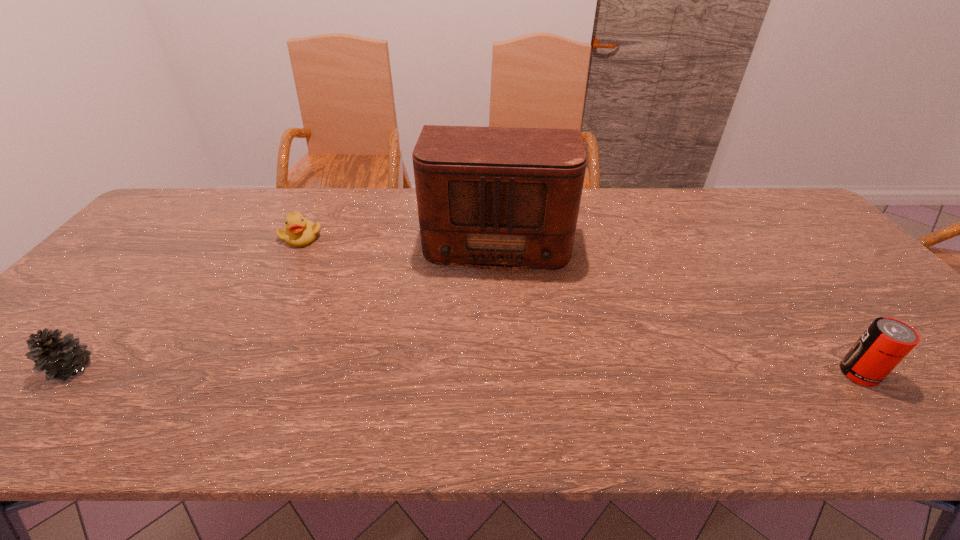
Identify the location of vacant space that's between the tallest object and the leftmost object. coord(284,303).

Where is `vacant point located between the radio receiver and the leftmost object`? This screenshot has height=540, width=960. vacant point located between the radio receiver and the leftmost object is located at coordinates (284, 303).

I want to click on empty location between the shortest object and the third shortest object, so click(x=580, y=305).

The height and width of the screenshot is (540, 960). What are the coordinates of `free area in between the leftmost object and the radio receiver` in the screenshot? It's located at (284, 303).

Image resolution: width=960 pixels, height=540 pixels. I want to click on empty space that is in between the rightmost object and the third object from right to left, so click(x=580, y=305).

At what (x,y) coordinates should I click in order to perform the action: click on the closest object to the tallest object. Please return your answer as a coordinate pair (x, y). The height and width of the screenshot is (540, 960). Looking at the image, I should click on tap(299, 232).

Select which object is the third closest to the rightmost object. Please provide its 2D coordinates. Your answer should be formatted as a tuple, i.e. [(x, y)], where the tuple contains the x and y coordinates of a point satisfying the conditions above.

[(60, 358)]

This screenshot has height=540, width=960. What are the coordinates of `vacant region that satisfies the following two spatial constraints: 1. on the front side of the shortest object; 2. on the left side of the tallest object` in the screenshot? It's located at (300, 238).

This screenshot has height=540, width=960. I want to click on vacant point that satisfies the following two spatial constraints: 1. on the front side of the tallest object; 2. on the right side of the third shortest object, so click(503, 374).

This screenshot has width=960, height=540. In order to click on vacant space that satisfies the following two spatial constraints: 1. on the front side of the shortest object; 2. on the left side of the rightmost object in this screenshot , I will do `click(231, 374)`.